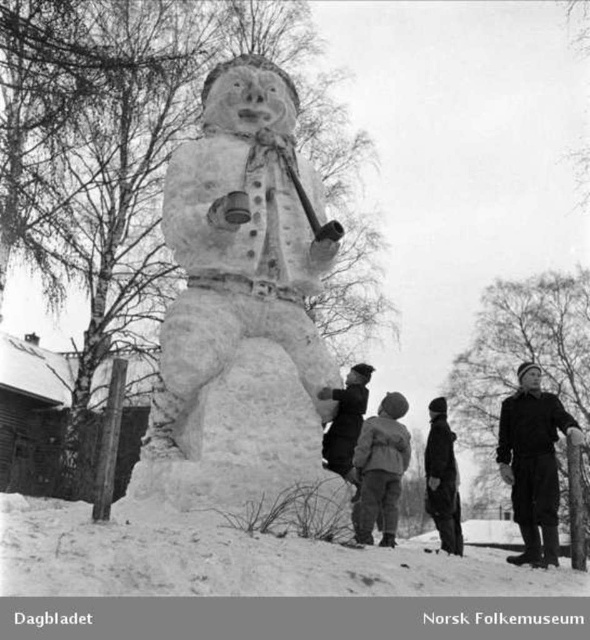
You are a photographer trying to capture the snowman in the winter scene. You want to focus on the dark gray woolen hat at upper right and the dark gray wool sweater at center. Which object should you adjust your camera focus on first if you want to start with the one closer to you?

The dark gray woolen hat at upper right is closer to the viewer than the dark gray wool sweater at center, so you should focus on the dark gray woolen hat at upper right first.